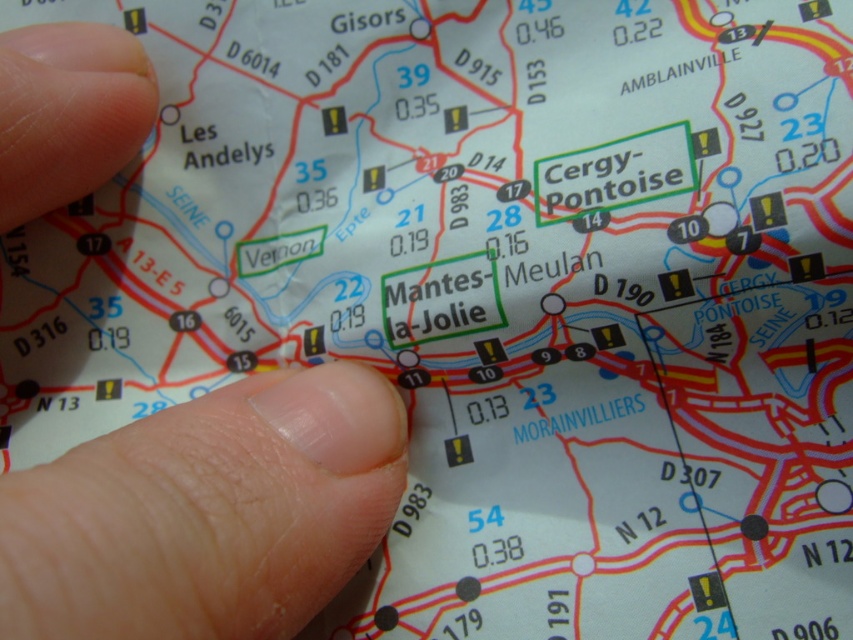
Question: Which point is closer to the camera?

Choices:
 (A) (312, 369)
 (B) (218, 634)
 (C) (62, 92)

Answer: (B)

Question: Among these objects, which one is farthest from the camera?

Choices:
 (A) finger at left
 (B) flesh-toned skin at upper left

Answer: (B)

Question: Can you confirm if finger at left is positioned to the left of pale skin finger at lower left?

Choices:
 (A) yes
 (B) no

Answer: (B)

Question: Can you confirm if finger at left is positioned to the left of flesh-toned skin at upper left?

Choices:
 (A) yes
 (B) no

Answer: (B)

Question: Is finger at left smaller than flesh-toned skin at upper left?

Choices:
 (A) no
 (B) yes

Answer: (A)

Question: Which of the following is the closest to the observer?

Choices:
 (A) flesh-toned skin at upper left
 (B) finger at left
 (C) pale skin finger at lower left

Answer: (C)